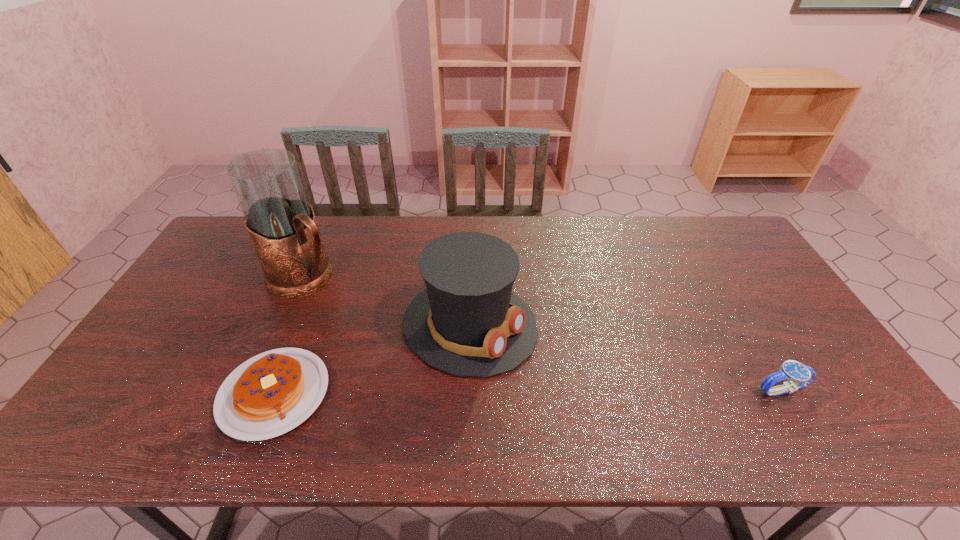
The width and height of the screenshot is (960, 540). What are the coordinates of `vacant region located with the handle on the side of the tallest object` in the screenshot? It's located at (423, 355).

At what (x,y) coordinates should I click in order to perform the action: click on free location located 0.180m with goggles on the front of the dress hat. Please return your answer as a coordinate pair (x, y). The image size is (960, 540). Looking at the image, I should click on (590, 387).

You are a GUI agent. You are given a task and a screenshot of the screen. Output one action in this format:
    pyautogui.click(x=<x>, y=<y>)
    Task: Click on the free region located 0.130m with goggles on the front of the dress hat
    
    Given the screenshot: What is the action you would take?
    pyautogui.click(x=572, y=377)

The image size is (960, 540). Identify the location of vacant space located 0.260m with goggles on the front of the dress hat. coord(622,403).

Locate an element on the screen. The width and height of the screenshot is (960, 540). object present at the far edge is located at coordinates tap(281, 224).

Locate an element on the screen. pancake at the near edge is located at coordinates (270, 394).

Image resolution: width=960 pixels, height=540 pixels. I want to click on watch present at the near edge, so click(799, 375).

Locate an element on the screen. object positioned at the right edge is located at coordinates (799, 375).

This screenshot has height=540, width=960. I want to click on object that is positioned at the near right corner, so click(x=799, y=375).

Where is `vacant area at the far edge`? vacant area at the far edge is located at coordinates (450, 225).